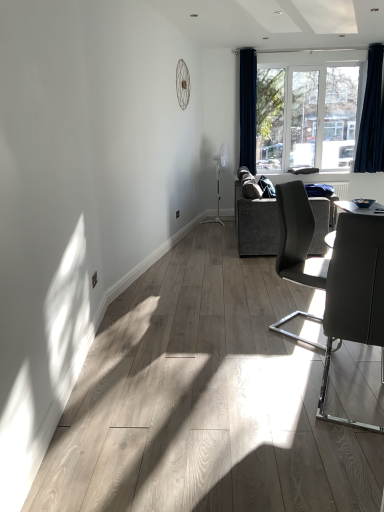
The image size is (384, 512). Find the location of `vacant space underneath matte gray chair at right, the second chair when ordered from back to front (from a real-world perspective)`. vacant space underneath matte gray chair at right, the second chair when ordered from back to front (from a real-world perspective) is located at coordinates (344, 406).